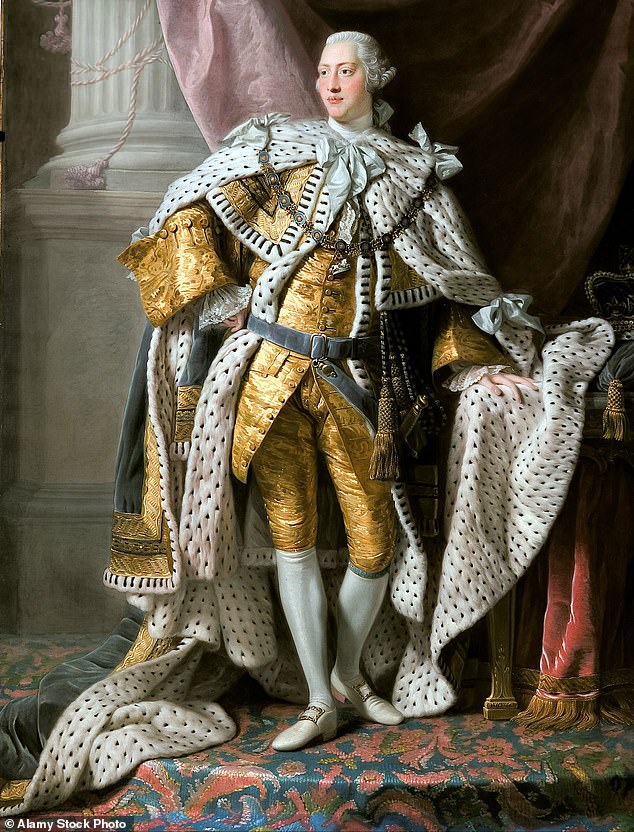
This screenshot has width=634, height=832. I want to click on edge of step, so click(276, 775).